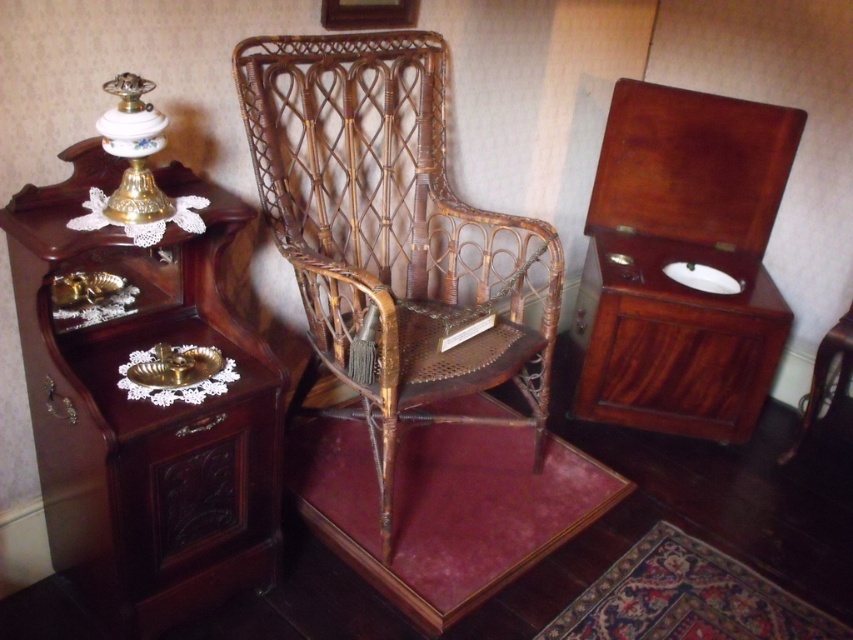
You are a guest in this room and want to place a small vase on the mahogany wood side table at left. However, you notice the woven brown cane chair at center is in the way. Can you place the vase on the table without moving the chair?

The mahogany wood side table at left is below the woven brown cane chair at center, so the chair is positioned above the table. Since the table is lower, you can easily place the vase on the table without needing to move the chair.

You are an interior designer planning to place a new rug in this vintage room. The rug will be positioned such that it covers the area from the wicker chair to the mahogany wood side table at left. Based on their positions, which object is closer to the center of the room?

The mahogany wood side table at left is closer to the center of the room than the wicker chair because its coordinates are closer to the center point.

You are an interior designer who needs to move a large antique rug into this room. The rug is too big to bring through the doorway, so you must determine if there is enough space between the mahogany wood side table at left and the woven brown cane chair at center to maneuver it into place. Can you fit the rug between them?

The mahogany wood side table at left is closer to the viewer than the woven brown cane chair at center, so there is sufficient space between them to maneuver the large antique rug into place.